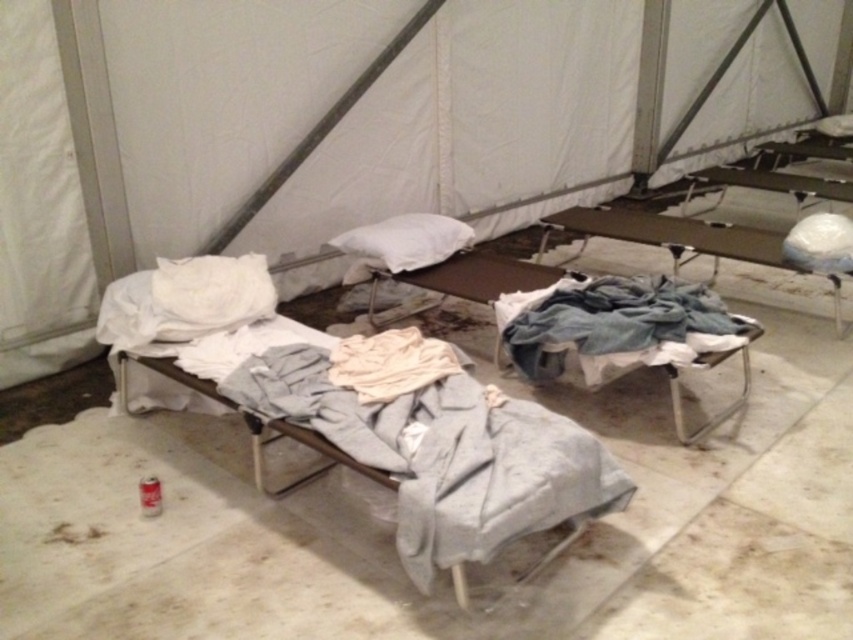
Question: Which object appears farthest from the camera in this image?

Choices:
 (A) white soft pillow at center
 (B) metallic gray bed frame at center
 (C) gray fabric bed frame at center

Answer: (A)

Question: Which object appears closest to the camera in this image?

Choices:
 (A) gray fabric bed frame at center
 (B) white soft pillow at center
 (C) metallic gray bed frame at center

Answer: (A)

Question: Does gray fabric bed frame at center appear under white soft pillow at center?

Choices:
 (A) no
 (B) yes

Answer: (B)

Question: Estimate the real-world distances between objects in this image. Which object is closer to the white soft pillow at center?

Choices:
 (A) gray fabric bed frame at center
 (B) metallic gray bed frame at center

Answer: (B)

Question: Is metallic gray bed frame at center positioned in front of white soft pillow at center?

Choices:
 (A) yes
 (B) no

Answer: (A)

Question: Does metallic gray bed frame at center have a larger size compared to white soft pillow at center?

Choices:
 (A) no
 (B) yes

Answer: (B)